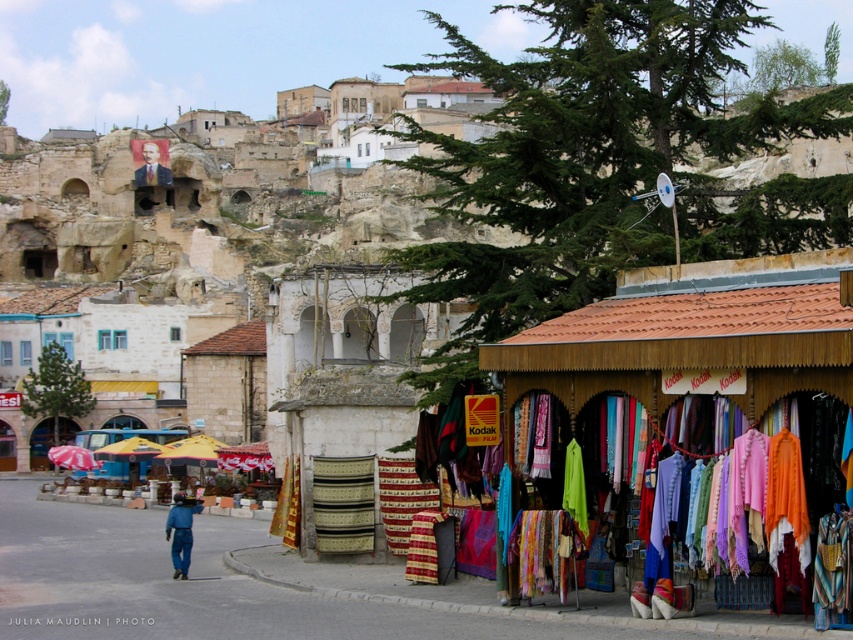
Which of these two, wooden stall at center or blue denim pants at lower left, stands shorter?

blue denim pants at lower left is shorter.

This screenshot has height=640, width=853. Describe the element at coordinates (693, 333) in the screenshot. I see `wooden stall at center` at that location.

Between point (631, 344) and point (178, 538), which one is positioned behind?

Point (178, 538)

The height and width of the screenshot is (640, 853). In order to click on wooden stall at center in this screenshot , I will do (x=693, y=333).

Which is below, wooden stall at center or smooth brown suit at upper left?

wooden stall at center is below.

In the scene shown: Can you confirm if wooden stall at center is positioned below smooth brown suit at upper left?

Indeed, wooden stall at center is positioned under smooth brown suit at upper left.

Based on the photo, measure the distance between point (x=572, y=349) and camera.

Point (x=572, y=349) and camera are 42.79 meters apart.

This screenshot has width=853, height=640. Find the location of `wooden stall at center`. wooden stall at center is located at coordinates pyautogui.click(x=693, y=333).

Looking at this image, does blue denim pants at lower left have a smaller size compared to smooth brown suit at upper left?

No, blue denim pants at lower left is not smaller than smooth brown suit at upper left.

Looking at this image, which of these two, blue denim pants at lower left or smooth brown suit at upper left, stands taller?

Standing taller between the two is blue denim pants at lower left.

Which is behind, point (172, 520) or point (140, 168)?

The point (140, 168) is behind.

Identify the location of blue denim pants at lower left. point(181,532).